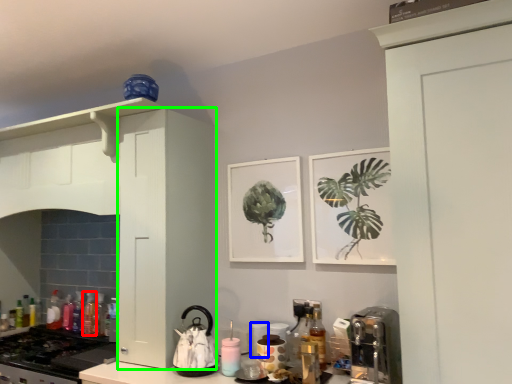
Question: Which is nearer to the bottle (highlighted by a red box)? appliance (highlighted by a blue box) or cabinetry (highlighted by a green box).

Choices:
 (A) appliance
 (B) cabinetry

Answer: (B)